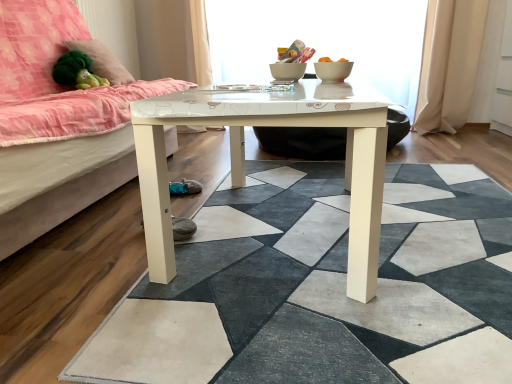
Question: Is white glossy table at center in front of green plush at upper left?

Choices:
 (A) no
 (B) yes

Answer: (B)

Question: Does white glossy table at center come behind green plush at upper left?

Choices:
 (A) no
 (B) yes

Answer: (A)

Question: Is white glossy table at center next to green plush at upper left?

Choices:
 (A) no
 (B) yes

Answer: (A)

Question: From the image's perspective, is white glossy table at center located above green plush at upper left?

Choices:
 (A) yes
 (B) no

Answer: (B)

Question: Is white glossy table at center oriented towards green plush at upper left?

Choices:
 (A) yes
 (B) no

Answer: (B)

Question: Is green plush toy at upper left spatially inside white glossy bowl at center, or outside of it?

Choices:
 (A) inside
 (B) outside

Answer: (B)

Question: From a real-world perspective, is green plush toy at upper left above or below white glossy bowl at center?

Choices:
 (A) below
 (B) above

Answer: (B)

Question: Considering the positions of green plush toy at upper left and white glossy bowl at center in the image, is green plush toy at upper left taller or shorter than white glossy bowl at center?

Choices:
 (A) short
 (B) tall

Answer: (B)

Question: Looking at the image, does green plush toy at upper left seem bigger or smaller compared to white glossy bowl at center?

Choices:
 (A) small
 (B) big

Answer: (B)

Question: Visually, is white glossy bowl at center positioned to the left or to the right of green plush toy at upper left?

Choices:
 (A) left
 (B) right

Answer: (B)

Question: Considering their positions, is white glossy bowl at center located in front of or behind green plush toy at upper left?

Choices:
 (A) behind
 (B) front

Answer: (B)

Question: From a real-world perspective, is white glossy bowl at center above or below green plush toy at upper left?

Choices:
 (A) below
 (B) above

Answer: (A)

Question: Looking at the image, does white glossy bowl at center seem bigger or smaller compared to green plush toy at upper left?

Choices:
 (A) big
 (B) small

Answer: (B)

Question: Considering the positions of green plush toy at upper left and green plush at upper left in the image, is green plush toy at upper left taller or shorter than green plush at upper left?

Choices:
 (A) short
 (B) tall

Answer: (A)

Question: From the image's perspective, is green plush toy at upper left positioned above or below green plush at upper left?

Choices:
 (A) above
 (B) below

Answer: (B)